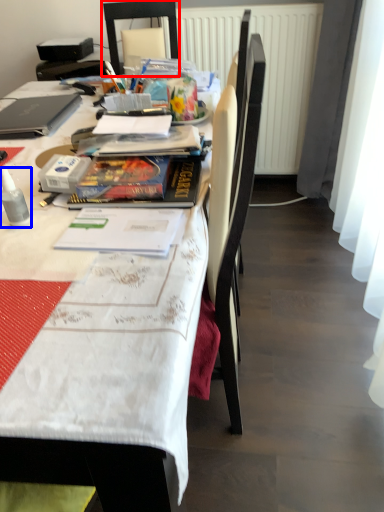
Question: Which point is further to the camera, chair (highlighted by a red box) or bottle (highlighted by a blue box)?

Choices:
 (A) chair
 (B) bottle

Answer: (A)